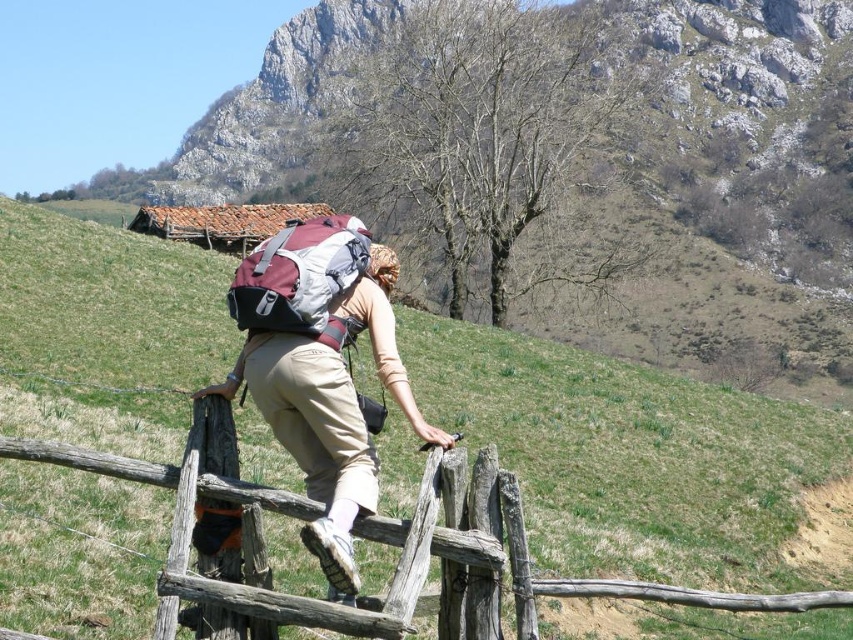
Is point (62, 326) less distant than point (288, 356)?

No.

Measure the distance between green grassy at center and camera.

green grassy at center is 8.41 meters from camera.

At what (x,y) coordinates should I click in order to perform the action: click on green grassy at center. Please return your answer as a coordinate pair (x, y). Looking at the image, I should click on (628, 456).

Describe the element at coordinates (294, 516) in the screenshot. The height and width of the screenshot is (640, 853). I see `weathered wood fence at center` at that location.

Is point (659, 595) less distant than point (326, 292)?

That is True.

What are the coordinates of `weathered wood fence at center` in the screenshot? It's located at (294, 516).

Is green grassy at center shorter than weathered wood fence at center?

No.

Which is behind, point (210, 285) or point (192, 474)?

The point (210, 285) is more distant.

What do you see at coordinates (628, 456) in the screenshot? This screenshot has height=640, width=853. I see `green grassy at center` at bounding box center [628, 456].

Locate an element on the screen. This screenshot has height=640, width=853. green grassy at center is located at coordinates (628, 456).